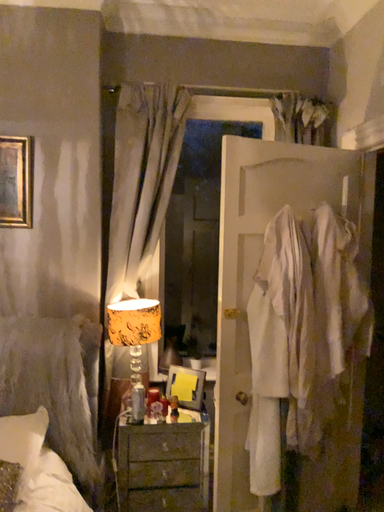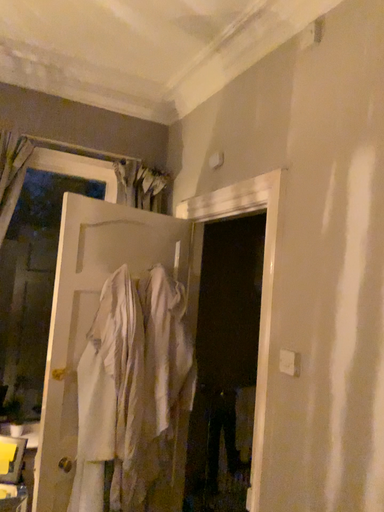
Question: Which way did the camera rotate in the video?

Choices:
 (A) rotated upward
 (B) rotated downward

Answer: (A)